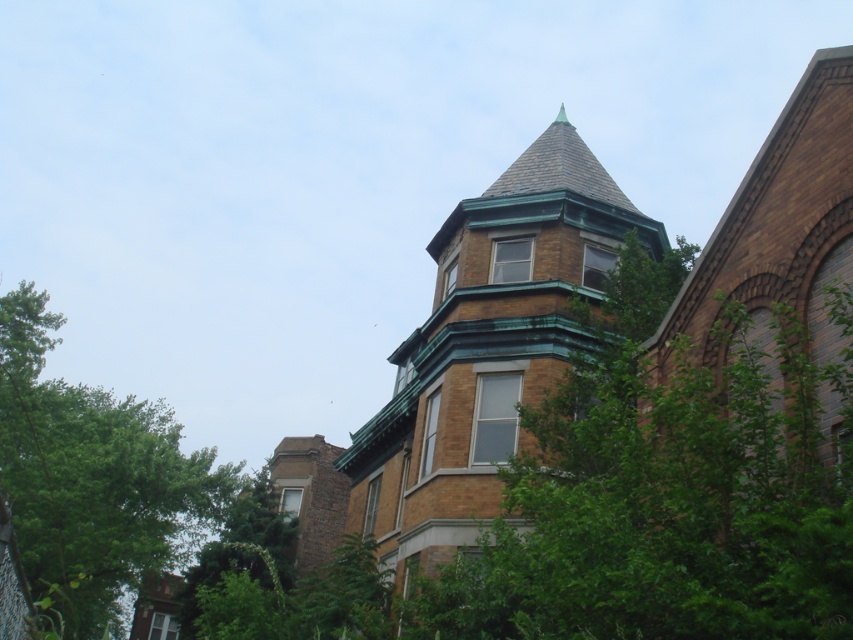
You are standing in front of the building and want to compare the widths of the brown brick tower at center and the green leafy tree at left. Which one is wider?

The green leafy tree at left is wider than the brown brick tower at center.

You are standing at the entrance of the building and want to locate the brown brick tower at center. According to the coordinates provided, where should you look relative to your position?

The brown brick tower at center is located at coordinates point [488,348], which means it is positioned slightly to the right and above your current viewpoint. You should look towards the upper right direction from your standing position at the entrance to find it.

You are standing in front of a multi story brick building with a corner turret. You see a point at coordinates (488, 348). What does this point correspond to?

The point at coordinates (488, 348) corresponds to the brown brick tower at center.